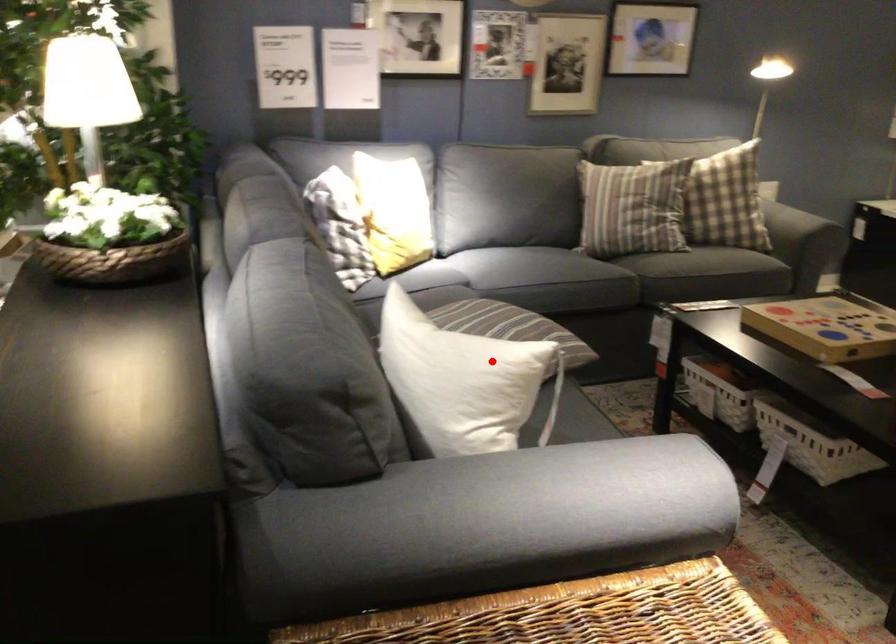
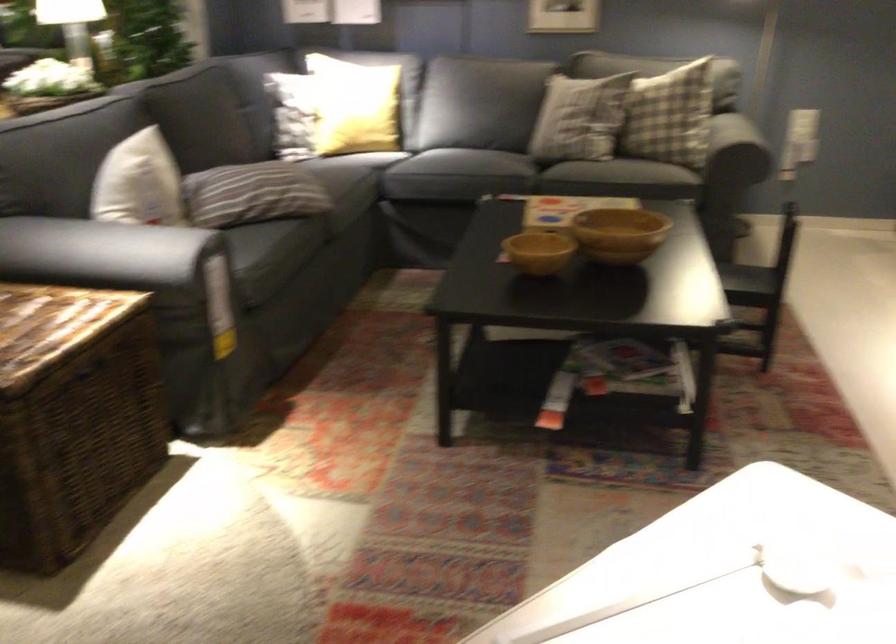
Question: I am providing you with two images of the same scene from different viewpoints. In image1, a red point is highlighted. Considering the same 3D point in image2, which of the following is correct?

Choices:
 (A) It is closer
 (B) It is farther

Answer: (B)